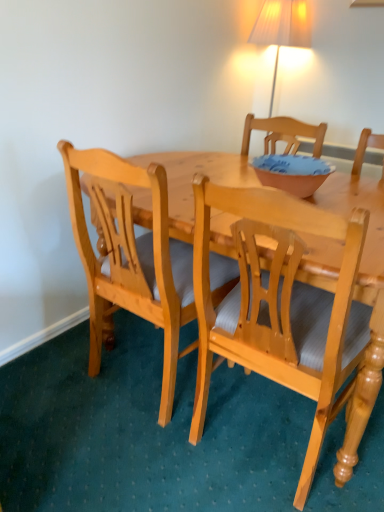
Locate an element on the screen. free space in front of light wood chair at center, the second chair viewed from the right is located at coordinates (x=121, y=462).